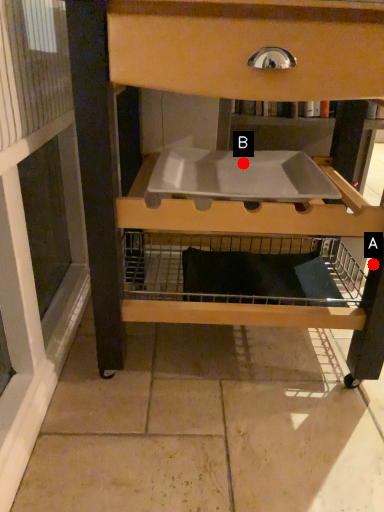
Question: Two points are circled on the image, labeled by A and B beside each circle. Which point is farther from the camera taking this photo?

Choices:
 (A) A is further
 (B) B is further

Answer: (B)